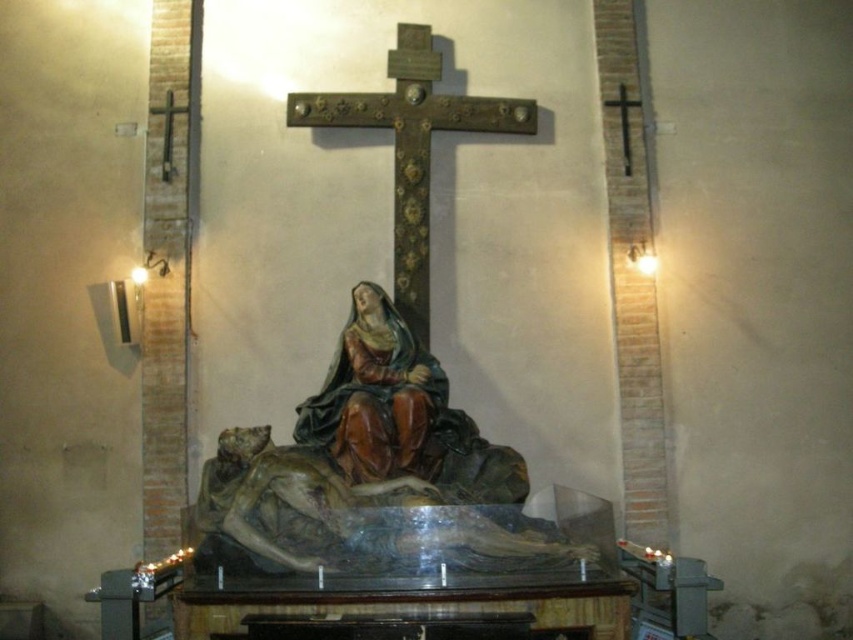
You are standing in front of the Piet statue and want to place two small offerings at the two specific points marked as point (308,406) and point (624,141). Which point should you place your offering closer to the viewer?

Point (308,406) is in front of point (624,141), so you should place your offering closer to the viewer at point (308,406).

You are an art conservator tasked with moving the wooden statue at center and the matte brown statue at center to a new exhibition space. The transport crate you have can only accommodate items up to the size of the larger statue. Which statue should you place in the crate first to ensure both fit?

The wooden statue at center is smaller than the matte brown statue at center, so you should place the matte brown statue at center first in the crate to ensure both fit.